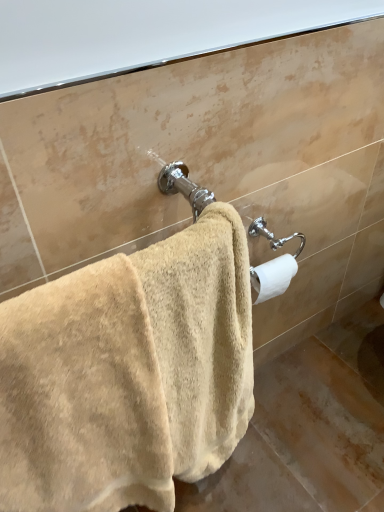
Question: In the image, is white matte toilet paper at right positioned in front of or behind beige plush towel at center?

Choices:
 (A) front
 (B) behind

Answer: (B)

Question: Is white matte toilet paper at right situated inside beige plush towel at center or outside?

Choices:
 (A) inside
 (B) outside

Answer: (B)

Question: From their relative heights in the image, would you say white matte toilet paper at right is taller or shorter than beige plush towel at center?

Choices:
 (A) short
 (B) tall

Answer: (A)

Question: From the image's perspective, is beige plush towel at center above or below white matte toilet paper at right?

Choices:
 (A) below
 (B) above

Answer: (A)

Question: In terms of width, does beige plush towel at center look wider or thinner when compared to white matte toilet paper at right?

Choices:
 (A) thin
 (B) wide

Answer: (B)

Question: From a real-world perspective, is beige plush towel at center above or below white matte toilet paper at right?

Choices:
 (A) below
 (B) above

Answer: (A)

Question: Considering the relative positions of beige plush towel at center and white matte toilet paper at right in the image provided, is beige plush towel at center to the left or to the right of white matte toilet paper at right?

Choices:
 (A) left
 (B) right

Answer: (A)